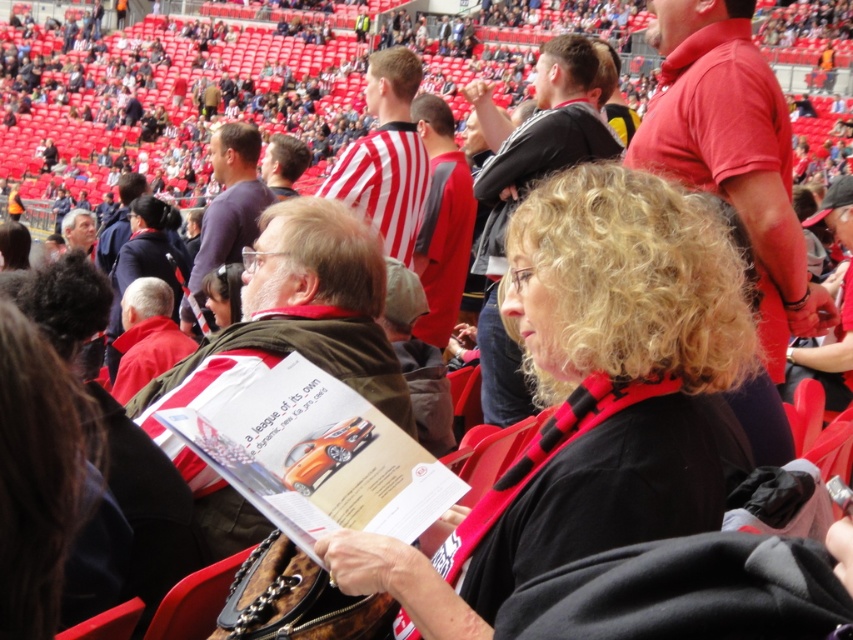
Question: Which object is positioned farthest from the purple matte shirt at upper center?

Choices:
 (A) black matte scarf at center
 (B) matte brown jacket at center

Answer: (A)

Question: Can you confirm if matte brown jacket at center is thinner than purple matte shirt at upper center?

Choices:
 (A) no
 (B) yes

Answer: (B)

Question: Which point appears closest to the camera in this image?

Choices:
 (A) (215, 529)
 (B) (233, 124)

Answer: (A)

Question: Does matte brown jacket at center lie behind purple matte shirt at upper center?

Choices:
 (A) no
 (B) yes

Answer: (A)

Question: Which point is farther from the camera taking this photo?

Choices:
 (A) (235, 349)
 (B) (225, 177)
 (C) (637, 532)

Answer: (B)

Question: Is black matte scarf at center thinner than matte brown jacket at center?

Choices:
 (A) no
 (B) yes

Answer: (A)